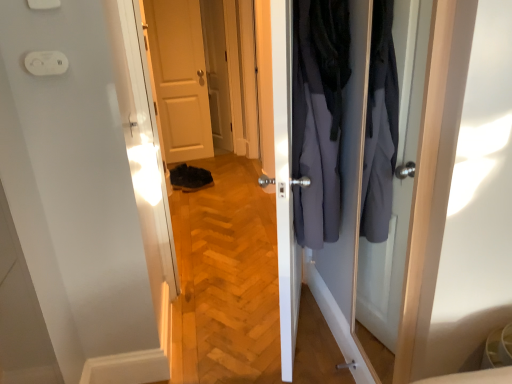
Question: Is black suede shoe at lower center situated inside dark gray fabric coat at center or outside?

Choices:
 (A) outside
 (B) inside

Answer: (A)

Question: From the image's perspective, relative to dark gray fabric coat at center, is black suede shoe at lower center above or below?

Choices:
 (A) below
 (B) above

Answer: (A)

Question: Estimate the real-world distances between objects in this image. Which object is closer to the black suede shoe at lower center?

Choices:
 (A) matte white door at center
 (B) silver metallic door handle at center
 (C) dark gray fabric coat at center
 (D) white plastic light switch at upper left
 (E) white plastic electric outlet at upper left

Answer: (A)

Question: Estimate the real-world distances between objects in this image. Which object is farther from the white plastic light switch at upper left?

Choices:
 (A) matte white door at center
 (B) dark gray fabric coat at center
 (C) silver metallic door handle at center
 (D) white plastic electric outlet at upper left
 (E) black suede shoe at lower center

Answer: (A)